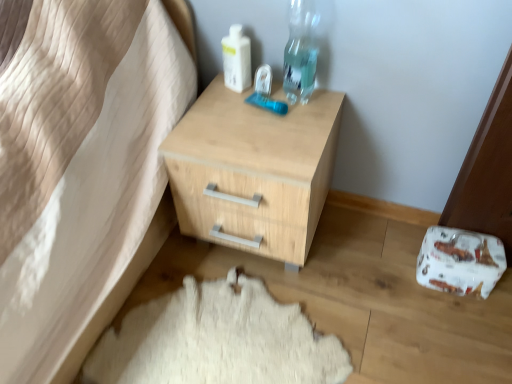
What are the coordinates of `vacant space underneath white woolen rug at lower center (from a real-world perspective)` in the screenshot? It's located at (237, 335).